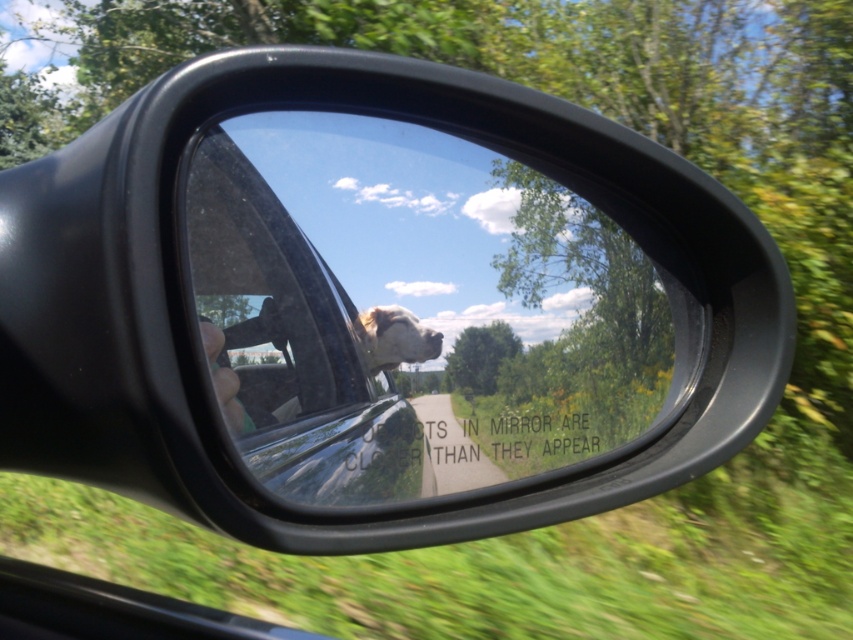
Is clear glass window at center above light brown fur at center?

Yes, clear glass window at center is above light brown fur at center.

This screenshot has height=640, width=853. Find the location of `clear glass window at center`. clear glass window at center is located at coordinates (421, 310).